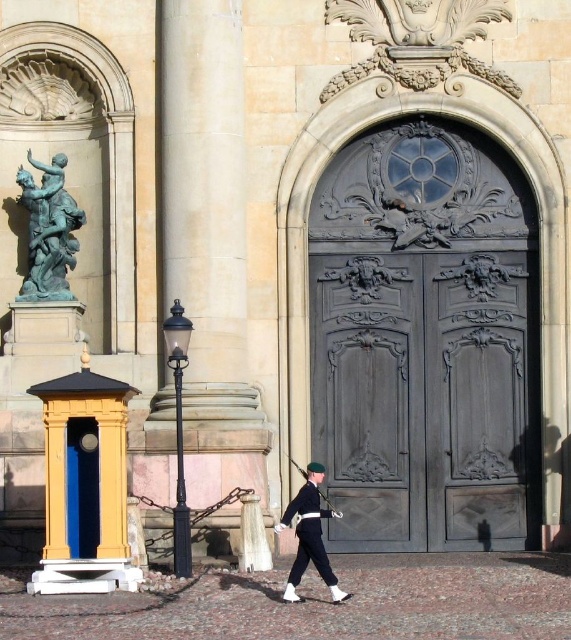
Question: Is bronze statue at left further to camera compared to white glossy uniform at center?

Choices:
 (A) no
 (B) yes

Answer: (B)

Question: Among these objects, which one is nearest to the camera?

Choices:
 (A) white glossy uniform at center
 (B) bronze statue at left

Answer: (A)

Question: Does bronze statue at left appear on the left side of white glossy uniform at center?

Choices:
 (A) yes
 (B) no

Answer: (A)

Question: Among these points, which one is nearest to the camera?

Choices:
 (A) (55, 252)
 (B) (291, 456)
 (C) (300, 563)
 (D) (71, 496)

Answer: (C)

Question: Is dark gray wood door at center thinner than polished wood rifle at center?

Choices:
 (A) yes
 (B) no

Answer: (B)

Question: Which point is farther to the camera?

Choices:
 (A) white glossy uniform at center
 (B) blue/grey wood door at center
 (C) polished wood rifle at center

Answer: (B)